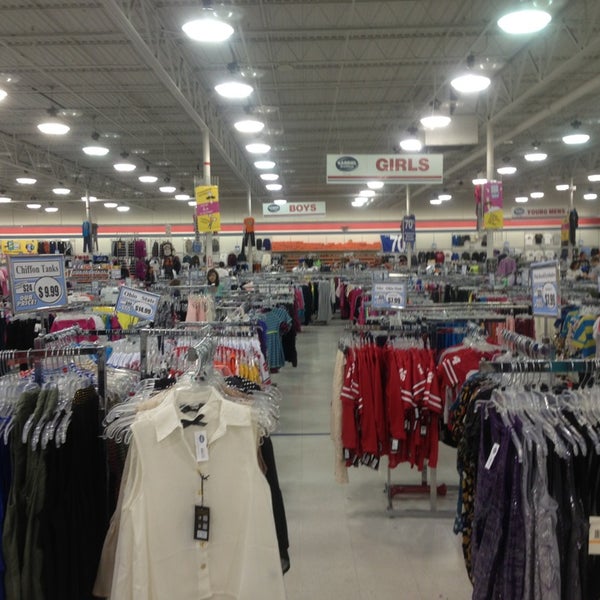
Image resolution: width=600 pixels, height=600 pixels. I want to click on red shirts on hanger, so click(x=349, y=407), click(x=361, y=407), click(x=377, y=407), click(x=390, y=407), click(x=400, y=407), click(x=412, y=395), click(x=451, y=372).